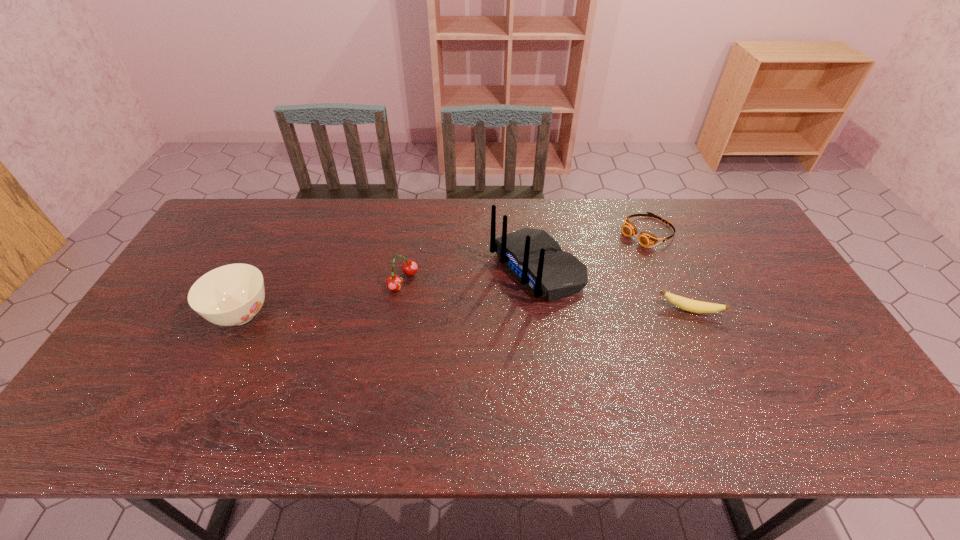
I want to click on sugar bowl, so click(230, 295).

At what (x,y) coordinates should I click in order to perform the action: click on banana. Please return your answer as a coordinate pair (x, y). Looking at the image, I should click on (687, 304).

This screenshot has width=960, height=540. In order to click on router in this screenshot , I will do `click(535, 259)`.

Where is `the tallest object`? The height and width of the screenshot is (540, 960). the tallest object is located at coordinates (535, 259).

Locate an element on the screen. The width and height of the screenshot is (960, 540). goggles is located at coordinates (646, 239).

Locate an element on the screen. cherry is located at coordinates (393, 283).

You are a GUI agent. You are given a task and a screenshot of the screen. Output one action in this format:
    pyautogui.click(x=<x>, y=<y>)
    Task: Click on the vacant space located 0.270m on the back of the sugar bowl
    Image resolution: width=960 pixels, height=540 pixels.
    Given the screenshot: What is the action you would take?
    pyautogui.click(x=283, y=233)

Identify the location of vacant region located 0.180m on the front of the banana. Image resolution: width=960 pixels, height=540 pixels. (719, 376).

Where is `free space located on the back of the router`? This screenshot has width=960, height=540. free space located on the back of the router is located at coordinates (377, 344).

This screenshot has width=960, height=540. I want to click on vacant space positioned on the back of the router, so click(x=454, y=308).